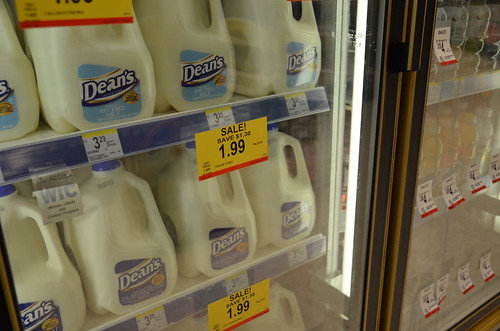
Identify the location of shelves. Image resolution: width=500 pixels, height=331 pixels. (165, 130), (191, 293), (336, 329), (456, 82), (413, 211), (445, 309).